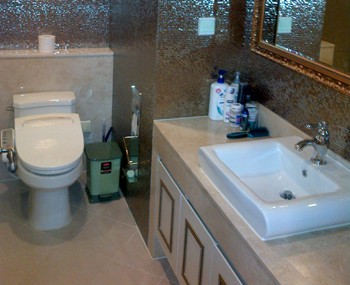
The image size is (350, 285). What are the coordinates of `trash bin` in the screenshot? It's located at (x=108, y=178).